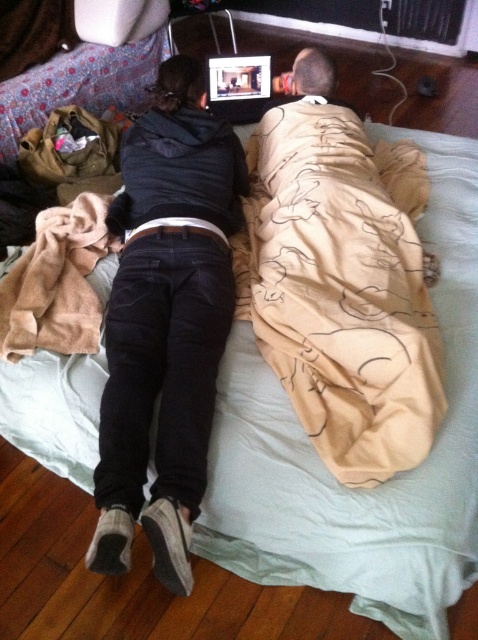
Question: Is beige cotton blanket at upper right to the right of black corduroy pants at center from the viewer's perspective?

Choices:
 (A) no
 (B) yes

Answer: (B)

Question: Which of the following is the closest to the observer?

Choices:
 (A) (178, 76)
 (B) (328, 179)

Answer: (B)

Question: Is beige cotton blanket at upper right to the right of black corduroy pants at center from the viewer's perspective?

Choices:
 (A) no
 (B) yes

Answer: (B)

Question: Which point is farther to the camera?

Choices:
 (A) (423, 179)
 (B) (226, 168)

Answer: (A)

Question: Does beige cotton blanket at upper right appear over black corduroy pants at center?

Choices:
 (A) no
 (B) yes

Answer: (B)